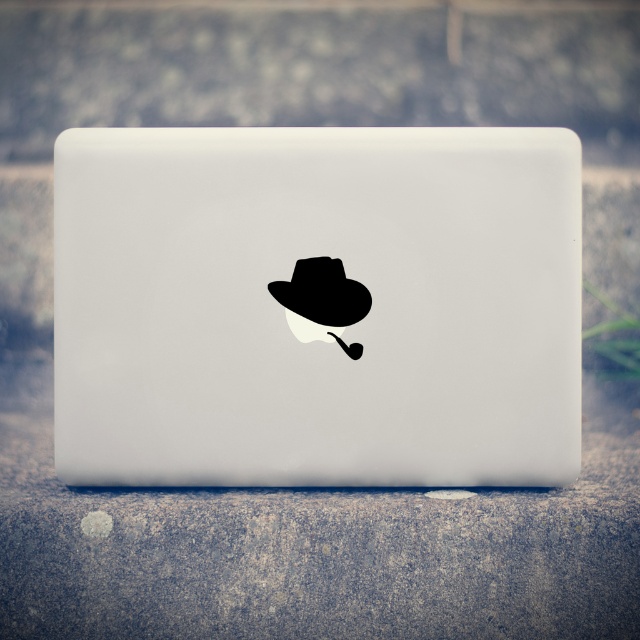
You are organizing a small display on a table and have both the white matte laptop at center and the black matte fedora at center. If you want to arrange them side by side without overlapping, which object should be placed first to ensure they both fit?

Since the white matte laptop at center is wider than the black matte fedora at center, you should place the white matte laptop at center first to accommodate its larger width, then position the black matte fedora at center next to it.

You are a photographer setting up a shoot. You have a white matte laptop at center and a black matte fedora at center. You want to ensure the fedora is visible in the background without blocking the laptop. Is the current arrangement suitable?

The black matte fedora at center is behind the white matte laptop at center, so the fedora will be in the background and not block the laptop, making the current arrangement suitable.